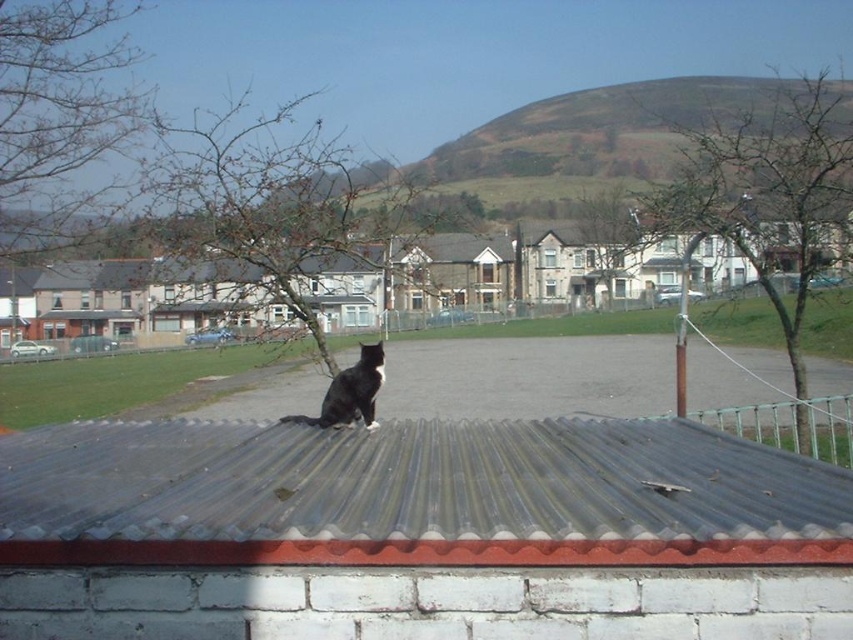
Is the position of bare branches at upper center more distant than that of bare branches at left?

Yes, it is.

Is bare branches at upper center above bare branches at left?

Yes, bare branches at upper center is above bare branches at left.

Based on the photo, who is more distant from viewer, (824, 144) or (132, 132)?

The point (132, 132) is behind.

The height and width of the screenshot is (640, 853). In order to click on bare branches at upper center in this screenshot , I will do click(x=769, y=202).

Does green leafy tree at upper center appear on the left side of black fur cat at center?

No, green leafy tree at upper center is not to the left of black fur cat at center.

This screenshot has width=853, height=640. What do you see at coordinates (608, 240) in the screenshot? I see `green leafy tree at upper center` at bounding box center [608, 240].

The width and height of the screenshot is (853, 640). What do you see at coordinates (608, 240) in the screenshot?
I see `green leafy tree at upper center` at bounding box center [608, 240].

Locate an element on the screen. The image size is (853, 640). green leafy tree at upper center is located at coordinates (608, 240).

Between bare branches at upper center and black fur cat at center, which one is positioned lower?

black fur cat at center

Describe the element at coordinates (769, 202) in the screenshot. I see `bare branches at upper center` at that location.

At what (x,y) coordinates should I click in order to perform the action: click on bare branches at upper center. Please return your answer as a coordinate pair (x, y). The width and height of the screenshot is (853, 640). Looking at the image, I should click on [x=769, y=202].